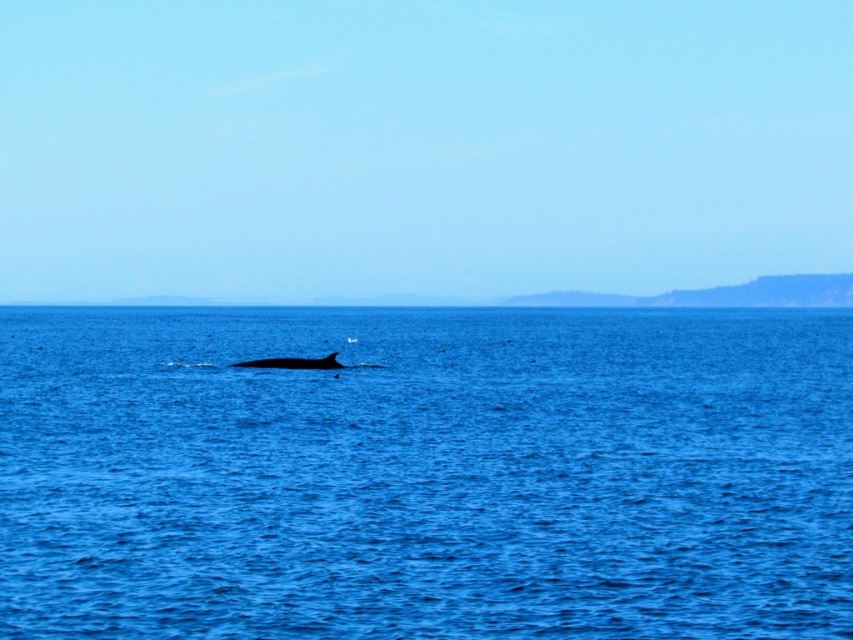
You are a sailor navigating a small boat. You see the point marked at coordinates (425, 474) in the image. What is located at that point?

The point at coordinates (425, 474) indicates blue water at center.

You are a photographer taking a picture of the seascape. You want to focus on the two points in the image. Which point is closer to your camera lens? The points are point at (553, 480) and point at (334, 360).

Point at (553, 480) is closer to the camera lens than point at (334, 360).

You are a sailor navigating a small boat and you see the blue water at center and the gray matte whale at center. Which object is positioned to the right side of the other?

The gray matte whale at center is positioned to the right of the blue water at center because the blue water at center is to the left of gray matte whale at center.